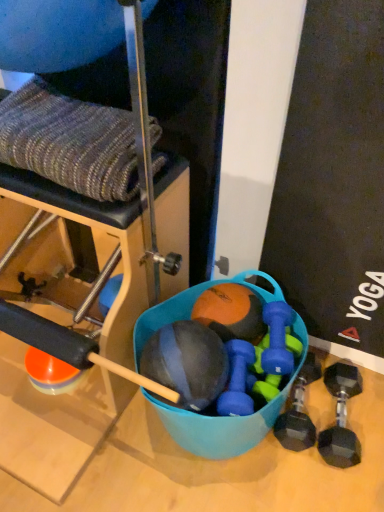
Question: Is knitted fabric at upper left facing towards blue rubber bucket at center?

Choices:
 (A) no
 (B) yes

Answer: (A)

Question: From a real-world perspective, is knitted fabric at upper left physically below blue rubber bucket at center?

Choices:
 (A) no
 (B) yes

Answer: (A)

Question: Is knitted fabric at upper left smaller than blue rubber bucket at center?

Choices:
 (A) yes
 (B) no

Answer: (B)

Question: Is knitted fabric at upper left completely or partially outside of blue rubber bucket at center?

Choices:
 (A) no
 (B) yes

Answer: (B)

Question: From the image's perspective, is knitted fabric at upper left located beneath blue rubber bucket at center?

Choices:
 (A) yes
 (B) no

Answer: (B)

Question: From a real-world perspective, is matte black medicine ball at center, placed as the 2th ball when sorted from back to front, positioned above or below orange matte ball at center, which is the first ball in back-to-front order?

Choices:
 (A) below
 (B) above

Answer: (B)

Question: In terms of width, does matte black medicine ball at center, placed as the 2th ball when sorted from back to front, look wider or thinner when compared to orange matte ball at center, which is the 2th ball from front to back?

Choices:
 (A) thin
 (B) wide

Answer: (B)

Question: Considering the positions of matte black medicine ball at center, the first ball positioned from the front, and orange matte ball at center, which is the 2th ball from front to back, in the image, is matte black medicine ball at center, the first ball positioned from the front, taller or shorter than orange matte ball at center, which is the 2th ball from front to back,?

Choices:
 (A) short
 (B) tall

Answer: (B)

Question: Is matte black medicine ball at center, the first ball positioned from the front, in front of or behind orange matte ball at center, which is the first ball in back-to-front order, in the image?

Choices:
 (A) front
 (B) behind

Answer: (A)

Question: Is blue rubber dumbbell at center, the first dumbbell from the left, in front of or behind black rubber dumbbell at lower right, positioned as the 4th dumbbell in left-to-right order, in the image?

Choices:
 (A) behind
 (B) front

Answer: (B)

Question: Is blue rubber dumbbell at center, the first dumbbell from the left, inside the boundaries of black rubber dumbbell at lower right, the 1th dumbbell positioned from the right, or outside?

Choices:
 (A) outside
 (B) inside

Answer: (A)

Question: In terms of size, does blue rubber dumbbell at center, the fourth dumbbell positioned from the right, appear bigger or smaller than black rubber dumbbell at lower right, the 1th dumbbell positioned from the right?

Choices:
 (A) small
 (B) big

Answer: (A)

Question: From a real-world perspective, is blue rubber dumbbell at center, the first dumbbell from the left, above or below black rubber dumbbell at lower right, the 1th dumbbell positioned from the right?

Choices:
 (A) above
 (B) below

Answer: (A)

Question: From a real-world perspective, is blue rubber bucket at center physically located above or below orange matte ball at center, which is the first ball in back-to-front order?

Choices:
 (A) below
 (B) above

Answer: (A)

Question: From the image's perspective, is blue rubber bucket at center located above or below orange matte ball at center, which is the first ball in back-to-front order?

Choices:
 (A) above
 (B) below

Answer: (B)